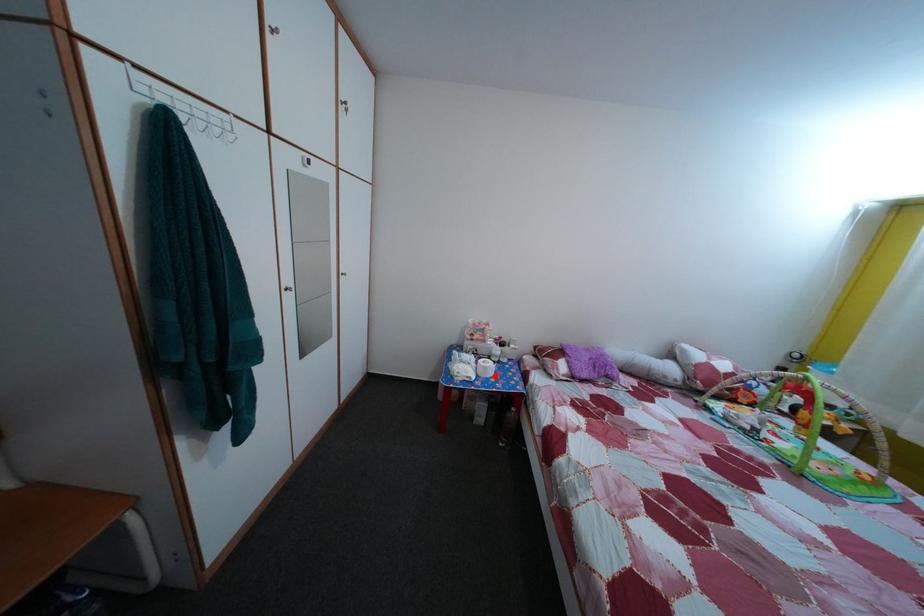
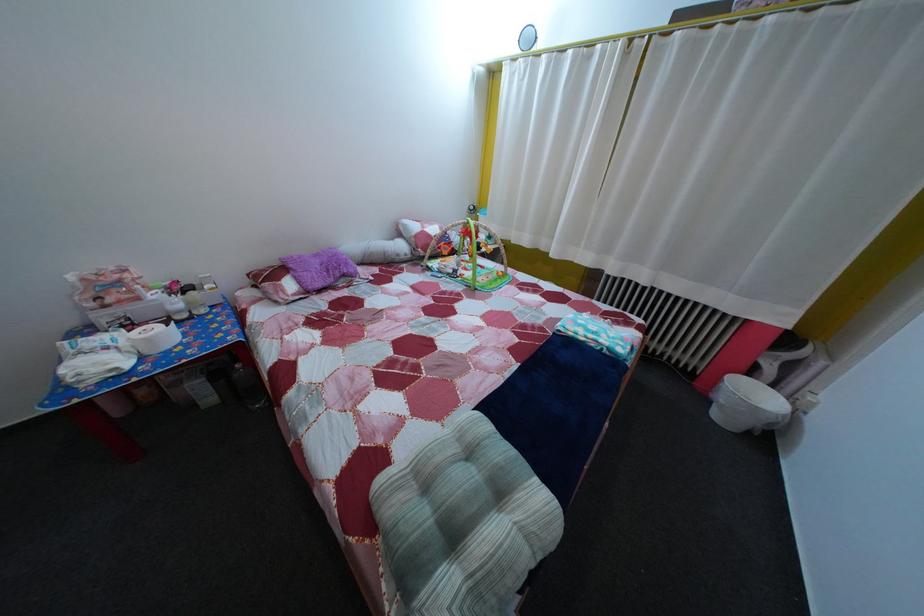
Question: I am providing you with two images of the same scene from different viewpoints. A red point is marked on the first image. At the location where the point appears in image 1, is it still visible in image 2?

Choices:
 (A) Yes
 (B) No

Answer: (A)